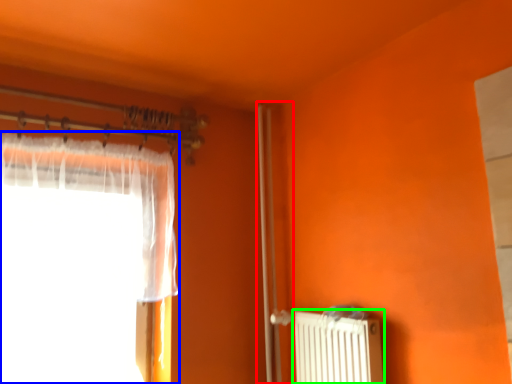
Question: Based on their relative distances, which object is farther from screen door (highlighted by a red box)? Choose from curtain (highlighted by a blue box) and radiator (highlighted by a green box).

Choices:
 (A) curtain
 (B) radiator

Answer: (A)